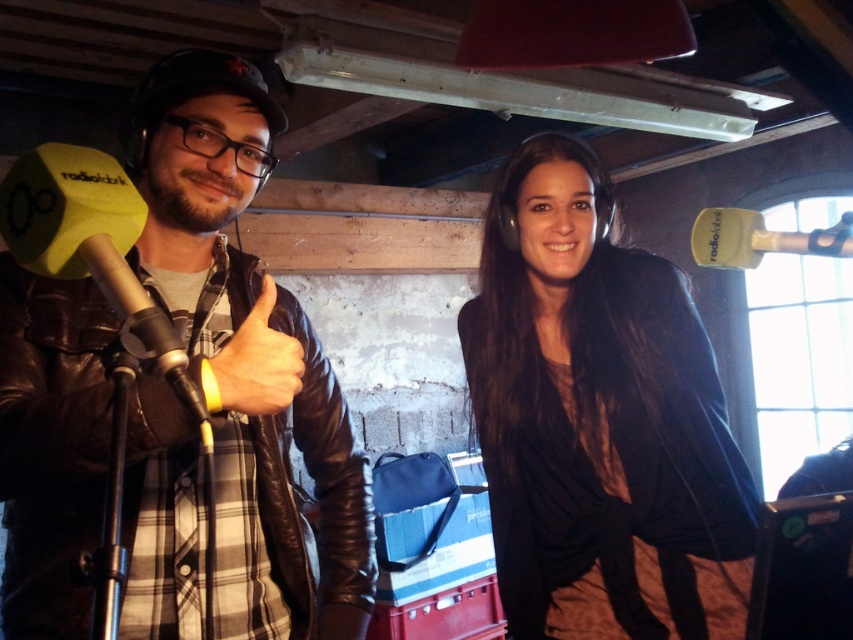
Based on the scene description, where is the leather jacket located in relation to the point marked at coordinates (x=248, y=355)?

The point at coordinates (x=248, y=355) marks the location of the leather jacket at left.

You are a photographer standing in front of the studio setup. You need to place a small decorative item exactly at the midpoint between the leather jacket at left and the microphone labeled radio clark. What are the coordinates of this midpoint?

The coordinates of the midpoint between the leather jacket at left and the microphone labeled radio clark would require knowing the position of the microphone labeled radio clark, which is not provided in the Objects Description. Therefore, the midpoint cannot be calculated with the given information.